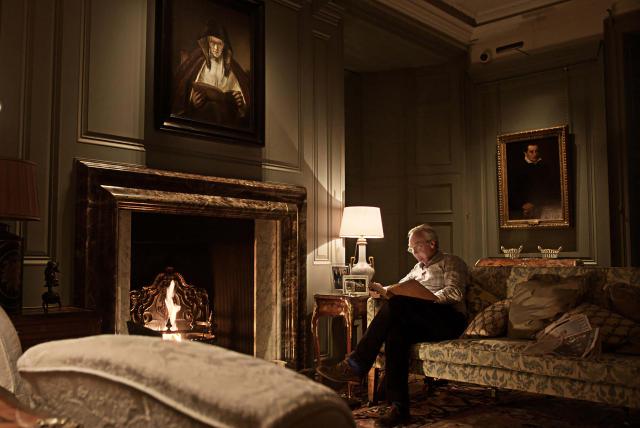
Where is `picture frame`? This screenshot has height=428, width=640. picture frame is located at coordinates (349, 275), (332, 272), (337, 288), (356, 294), (365, 288), (342, 281).